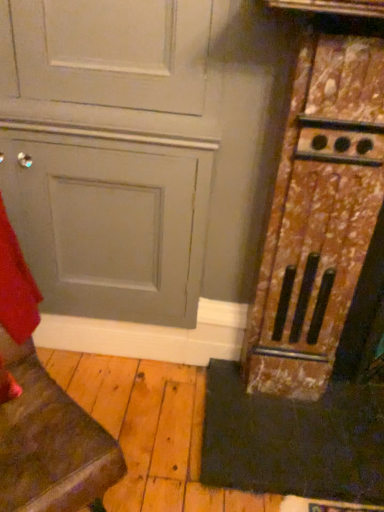
Question: From the image's perspective, does black rubber doormat at lower right appear higher than matte gray door at lower left?

Choices:
 (A) yes
 (B) no

Answer: (B)

Question: Considering the relative sizes of black rubber doormat at lower right and matte gray door at lower left in the image provided, is black rubber doormat at lower right shorter than matte gray door at lower left?

Choices:
 (A) no
 (B) yes

Answer: (B)

Question: Does black rubber doormat at lower right have a larger size compared to matte gray door at lower left?

Choices:
 (A) yes
 (B) no

Answer: (B)

Question: Is black rubber doormat at lower right positioned with its back to matte gray door at lower left?

Choices:
 (A) no
 (B) yes

Answer: (A)

Question: Does black rubber doormat at lower right have a greater height compared to matte gray door at lower left?

Choices:
 (A) no
 (B) yes

Answer: (A)

Question: From the image's perspective, is black rubber doormat at lower right beneath matte gray door at lower left?

Choices:
 (A) yes
 (B) no

Answer: (A)

Question: Is matte gray door at lower left positioned in front of rusty wood stove at right?

Choices:
 (A) no
 (B) yes

Answer: (B)

Question: Is matte gray door at lower left not within rusty wood stove at right?

Choices:
 (A) no
 (B) yes

Answer: (B)

Question: From the image's perspective, is matte gray door at lower left located beneath rusty wood stove at right?

Choices:
 (A) yes
 (B) no

Answer: (A)

Question: Is the position of matte gray door at lower left more distant than that of rusty wood stove at right?

Choices:
 (A) yes
 (B) no

Answer: (B)

Question: Is matte gray door at lower left surrounding rusty wood stove at right?

Choices:
 (A) yes
 (B) no

Answer: (B)

Question: Can you confirm if matte gray door at lower left is thinner than rusty wood stove at right?

Choices:
 (A) no
 (B) yes

Answer: (A)

Question: Considering the relative positions of matte gray door at lower left and matte gray door at center in the image provided, is matte gray door at lower left in front of matte gray door at center?

Choices:
 (A) no
 (B) yes

Answer: (B)